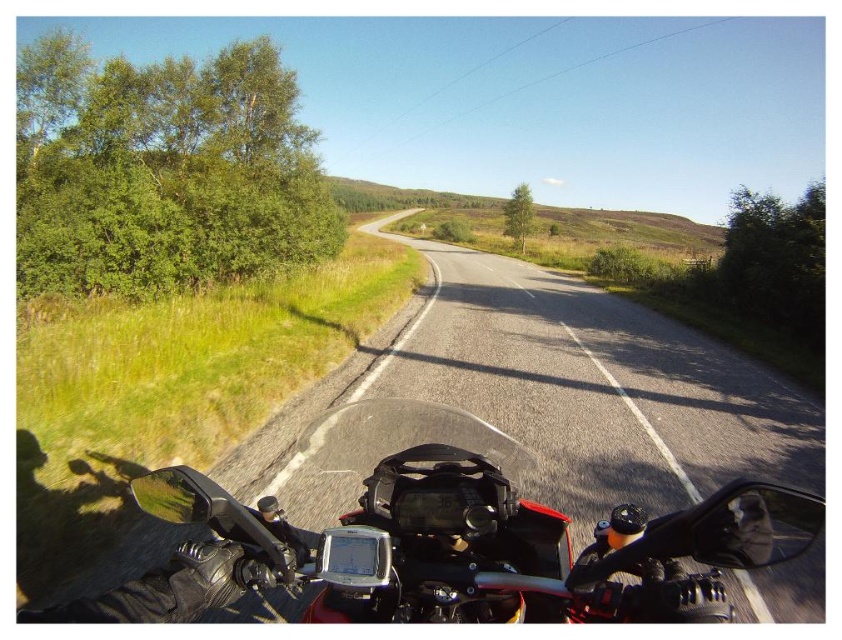
You are a rider on a motorcycle and want to check if your shiny black motorcycle at center is visible in the rearview mirror. The rearview mirror is located at point (451, 538). Is your motorcycle visible in the mirror?

The point (451, 538) indicates the shiny black motorcycle at center, so the motorcycle is located where the rearview mirror is placed. Therefore, the motorcycle cannot be seen in its own rearview mirror as it would be behind the mirror.

You are a delivery rider who needs to place a GPS device on your motorcycle. The GPS must be placed exactly 3 meters away from your helmet. Can you place it on the shiny black motorcycle at center if your current helmet is the black matte helmet at upper left?

The shiny black motorcycle at center and black matte helmet at upper left are 2.89 meters apart. Since the required distance is 3 meters, the GPS cannot be placed on the shiny black motorcycle at center as it is 0.11 meters too close.

In the scene shown: You are a rider looking at the road ahead. You see the shiny black motorcycle at center and the black matte helmet at upper left. Which object is closer to you?

The shiny black motorcycle at center is closer to you because it is further to the viewer than the black matte helmet at upper left, meaning it appears nearer in the visual perspective.